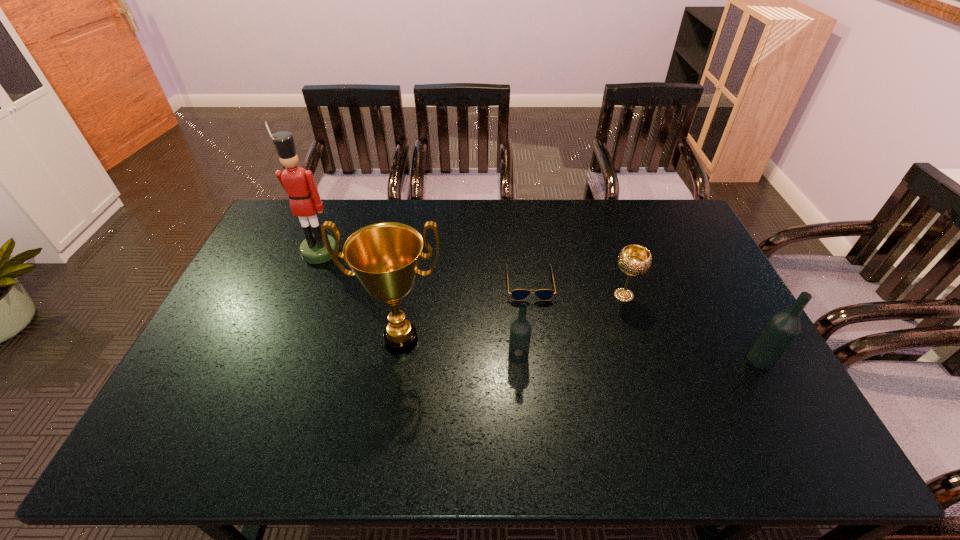
Find the location of `empty space between the taller vodka and the sunglasses`. empty space between the taller vodka and the sunglasses is located at coordinates (645, 321).

Locate which object is the fourth closest to the shortest object. Please provide its 2D coordinates. Your answer should be formatted as a tuple, i.e. [(x, y)], where the tuple contains the x and y coordinates of a point satisfying the conditions above.

[(782, 329)]

Image resolution: width=960 pixels, height=540 pixels. Identify the location of object that is the third nearest to the right vodka. (520, 331).

What are the coordinates of `vacant space that satisfies the following two spatial constraints: 1. on the front-facing side of the shorter vodka; 2. on the right side of the leftmost object` in the screenshot? It's located at (279, 356).

In order to click on vacant space that satisfies the following two spatial constraints: 1. on the front-facing side of the shortest object; 2. on the right side of the chalice in this screenshot , I will do `click(531, 295)`.

Locate an element on the screen. The height and width of the screenshot is (540, 960). free location that satisfies the following two spatial constraints: 1. on the front-facing side of the third tallest object; 2. on the left side of the shortest object is located at coordinates (539, 360).